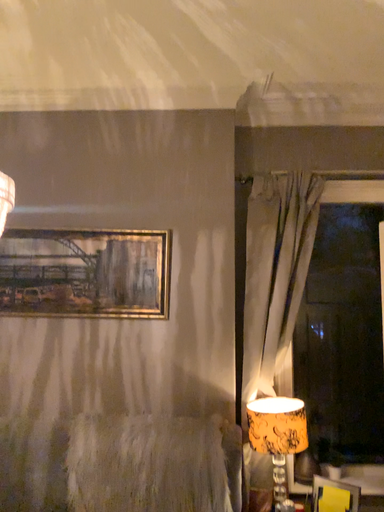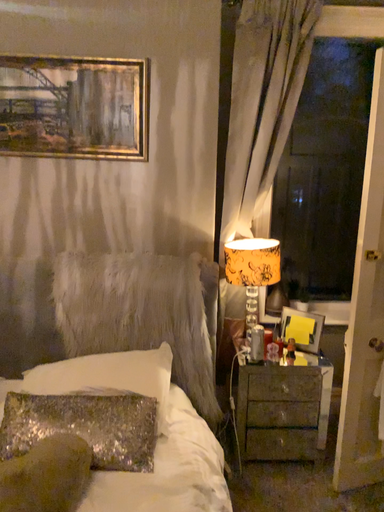
Question: Which way did the camera rotate in the video?

Choices:
 (A) rotated upward
 (B) rotated downward

Answer: (B)